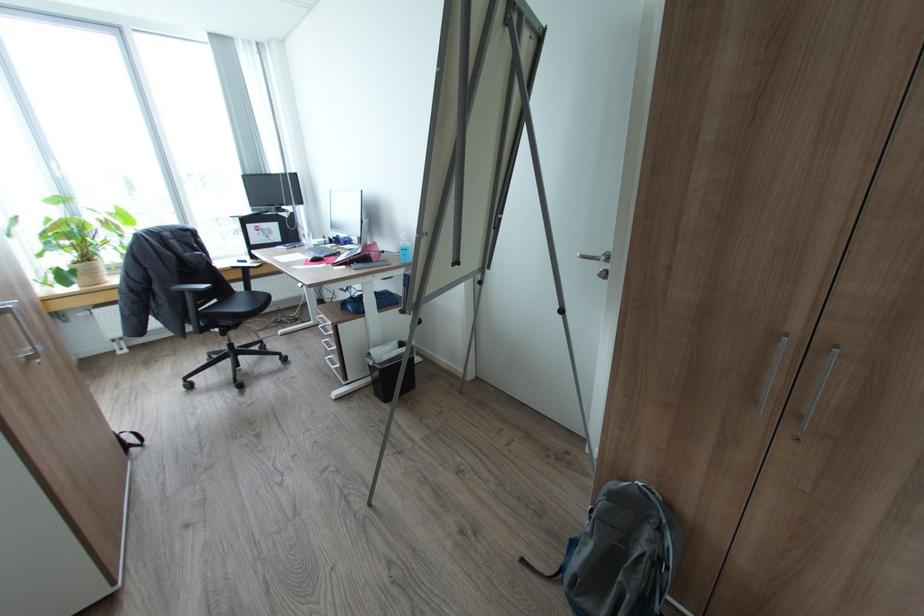
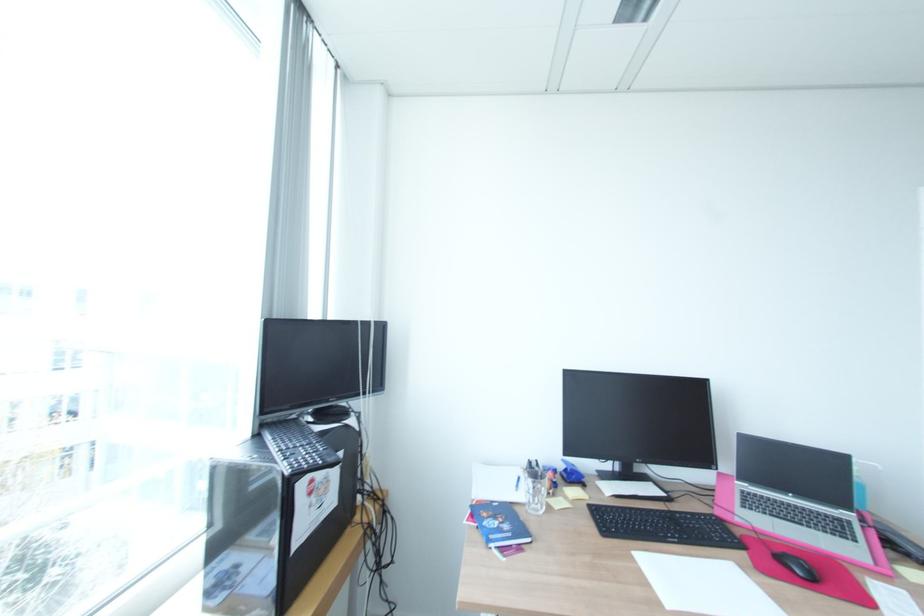
Where in the second image is the point corresponding to pixel 318 253 from the first image?

(681, 541)